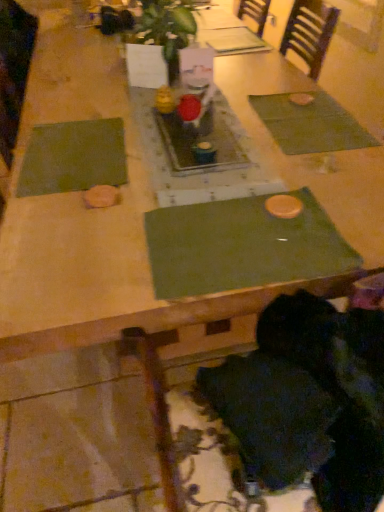
Where is `vacant space situated on the left part of green fabric place mat at center, which appears as the second place mat when viewed from the left`? This screenshot has width=384, height=512. vacant space situated on the left part of green fabric place mat at center, which appears as the second place mat when viewed from the left is located at coordinates (91, 240).